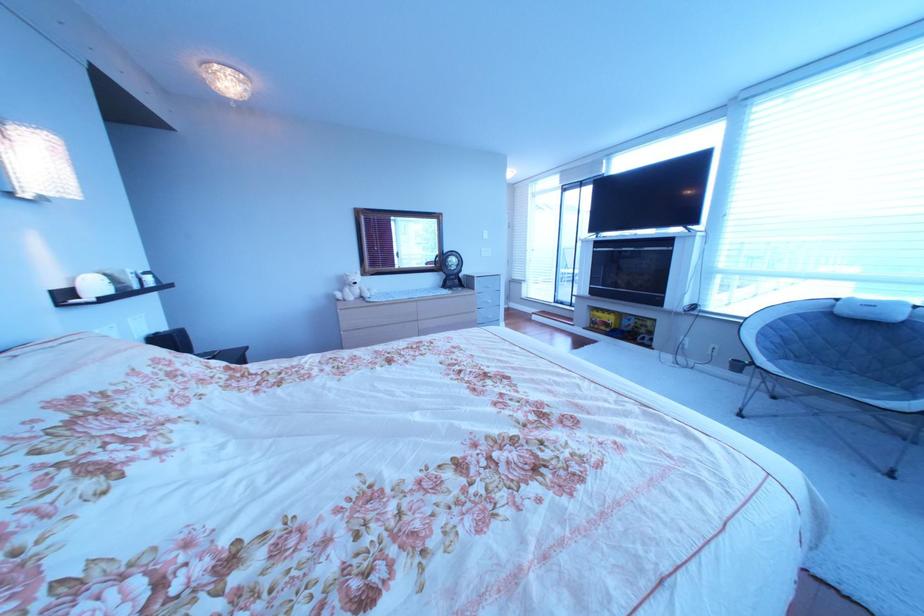
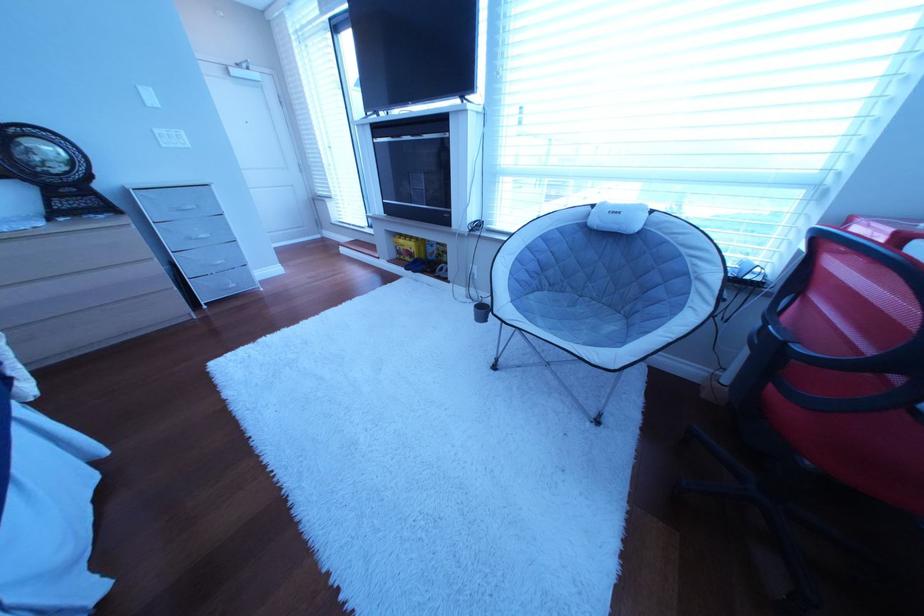
In a continuous first-person perspective shot, in which direction is the camera moving?

The movement direction of the cameraman is right, forward.